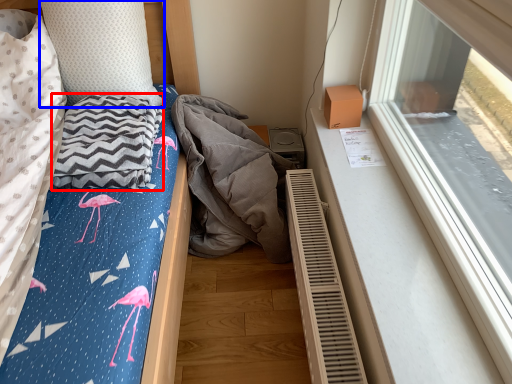
Question: Which of the following is the farthest to the observer, blanket (highlighted by a red box) or pillow (highlighted by a blue box)?

Choices:
 (A) blanket
 (B) pillow

Answer: (B)